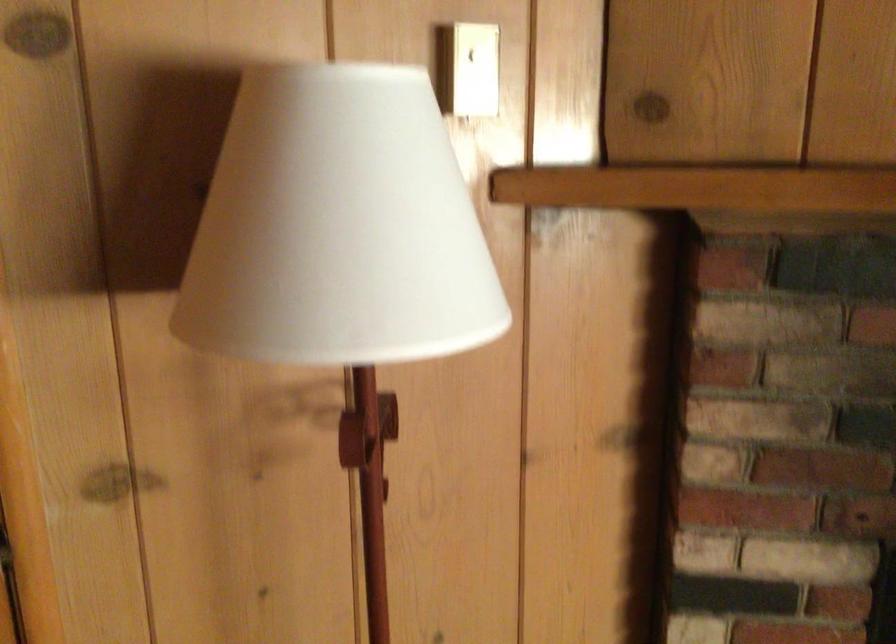
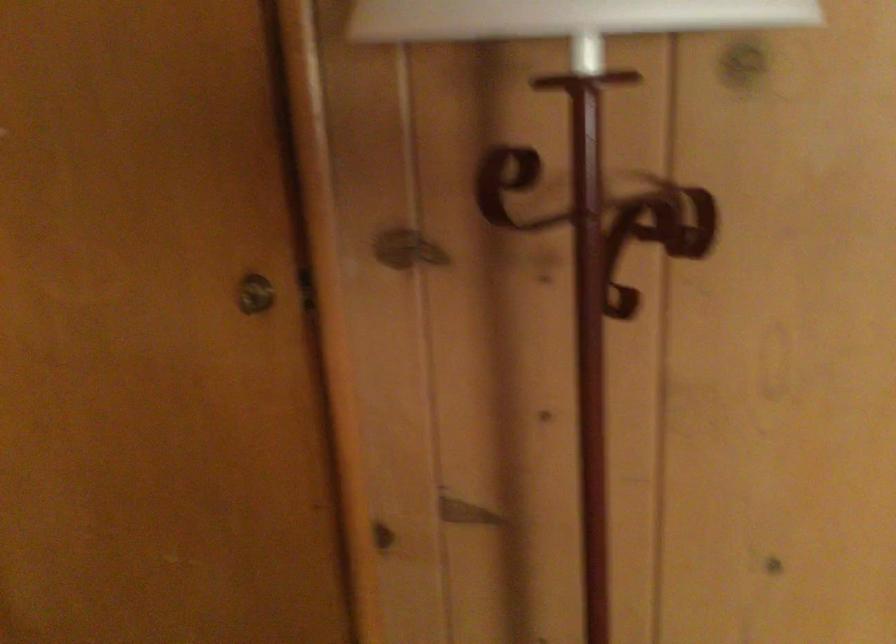
In the second image, find the point that corresponds to pixel 425 313 in the first image.

(564, 17)